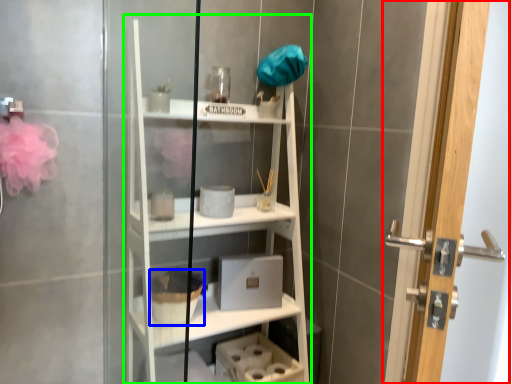
Question: Which is farther away from door (highlighted by a red box)? basket (highlighted by a blue box) or bookshelf (highlighted by a green box)?

Choices:
 (A) basket
 (B) bookshelf

Answer: (A)